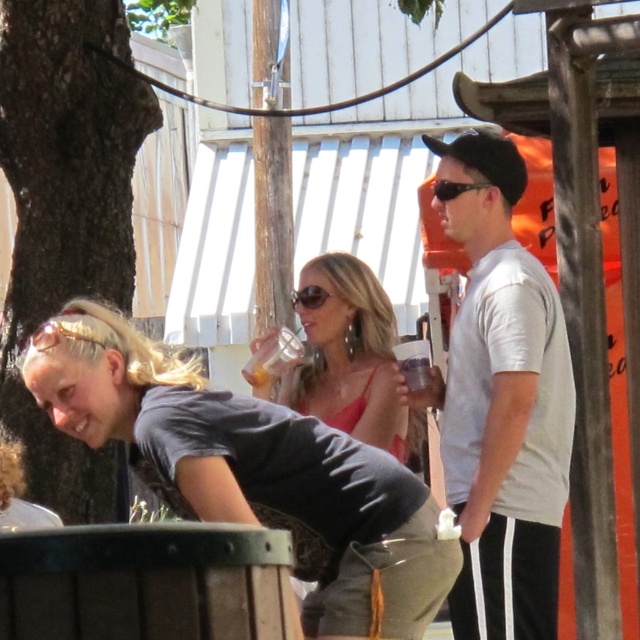
You are standing at the point marked by coordinates point (253, 472) in the image. Looking around, you see a matte gray shirt at lower left. Which direction should you face to see the matte gray shirt at lower left?

The point (253, 472) is already at the location of the matte gray shirt at lower left, so you are already facing it.